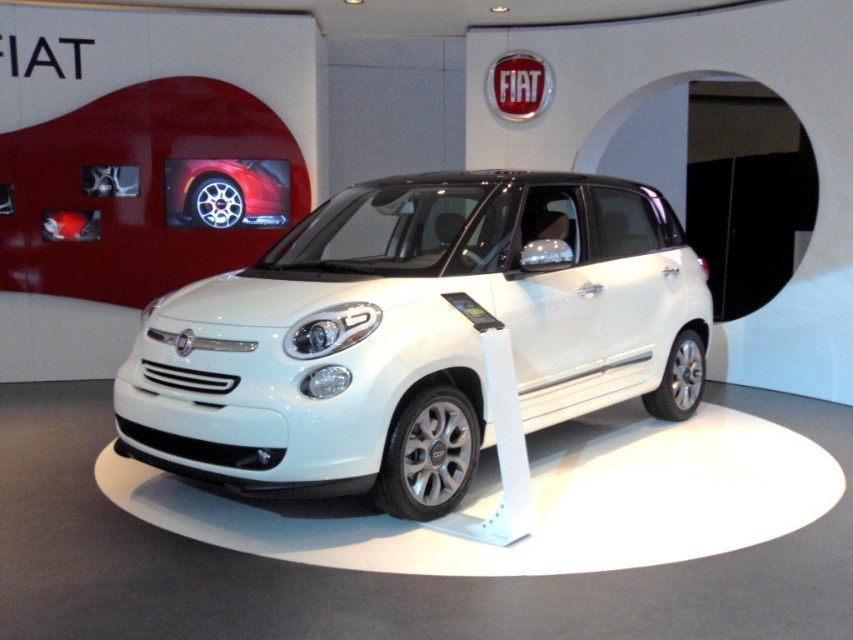
You are standing in the showroom and want to find the white metallic car at center. According to the coordinates, where is it located?

The white metallic car at center is located at coordinates point (416, 336).

You are a photographer standing in front of the white metallic car at center and the shiny silver rim at center. You want to take a photo that captures both objects clearly. Which object should you focus on first to ensure both are in sharp focus?

The white metallic car at center is in front of the shiny silver rim at center. To ensure both are in sharp focus, you should focus on the white metallic car at center first, as it is closer to the camera, and the rim will naturally fall into focus if the depth of field is sufficient.

You are a photographer standing in front of the white metallic car at center and the shiny silver rim at center. You want to capture a photo where the car is on the left side of the frame. Should you move to your left or right to achieve this?

The white metallic car at center is to the right of the shiny silver rim at center. To have the car on the left side of the frame, you should move to your right so that the car shifts to the left relative to the rim.